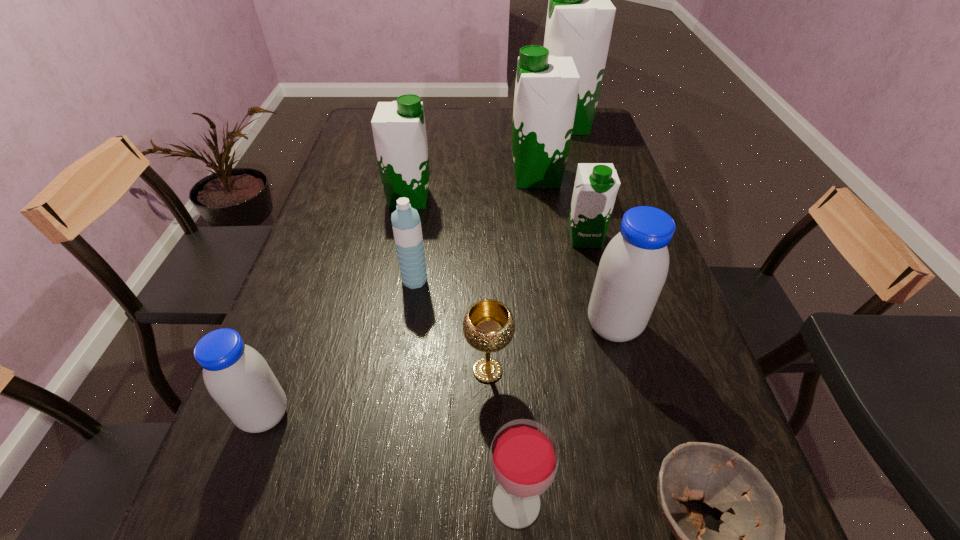
The image size is (960, 540). I want to click on the smallest green soya milk, so click(596, 185).

Locate an element on the screen. the nearest green soya milk is located at coordinates (596, 185).

The image size is (960, 540). I want to click on the left blue soya milk, so click(x=238, y=378).

Where is `the nearest soya milk`? the nearest soya milk is located at coordinates (238, 378).

Find the location of a particular element. The width and height of the screenshot is (960, 540). wineglass is located at coordinates (524, 457).

I want to click on the seventh farthest object, so click(x=488, y=326).

The image size is (960, 540). I want to click on free space located on the front-facing side of the biggest green soya milk, so click(x=458, y=125).

Where is `vacant space positioned on the front-facing side of the biggest green soya milk`? vacant space positioned on the front-facing side of the biggest green soya milk is located at coordinates (452, 125).

Identify the location of blank area located 0.230m on the front-facing side of the biggest green soya milk. (474, 125).

You are a GUI agent. You are given a task and a screenshot of the screen. Output one action in this format:
    pyautogui.click(x=<x>, y=<y>)
    Task: Click on the vacant region located 0.060m on the front-facing side of the second tallest soya milk
    The height and width of the screenshot is (540, 960).
    Given the screenshot: What is the action you would take?
    pyautogui.click(x=491, y=177)